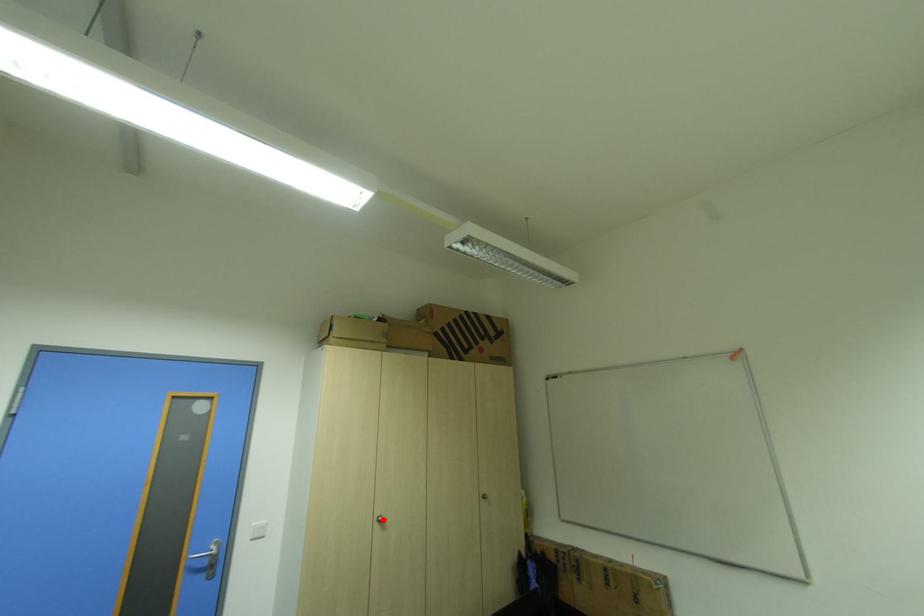
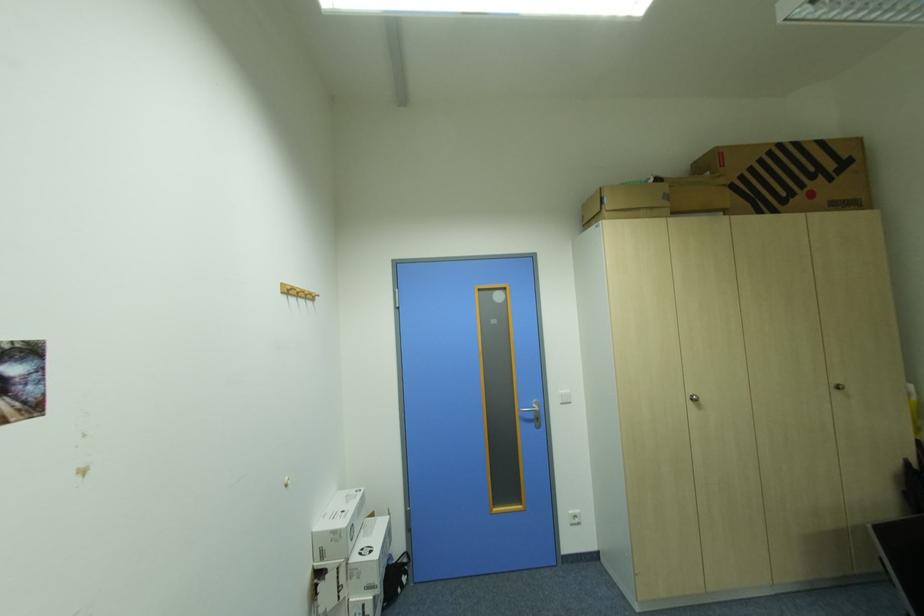
Find the pixel in the second image that matches the highlighted location in the first image.

(697, 399)